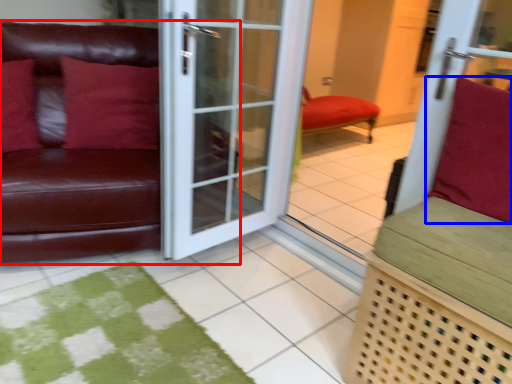
Question: Which of the following is the closest to the observer, studio couch (highlighted by a red box) or pillow (highlighted by a blue box)?

Choices:
 (A) studio couch
 (B) pillow

Answer: (B)